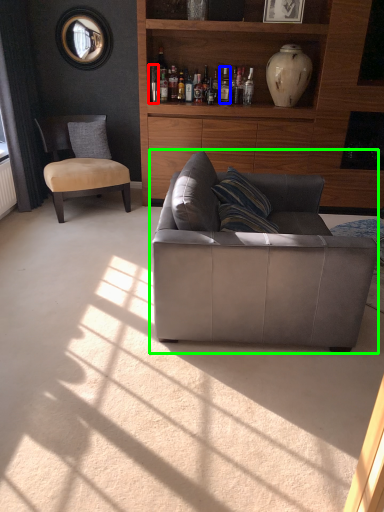
Question: Which object is the closest to the bottle (highlighted by a red box)? Choose among these: bottle (highlighted by a blue box) or studio couch (highlighted by a green box).

Choices:
 (A) bottle
 (B) studio couch

Answer: (A)